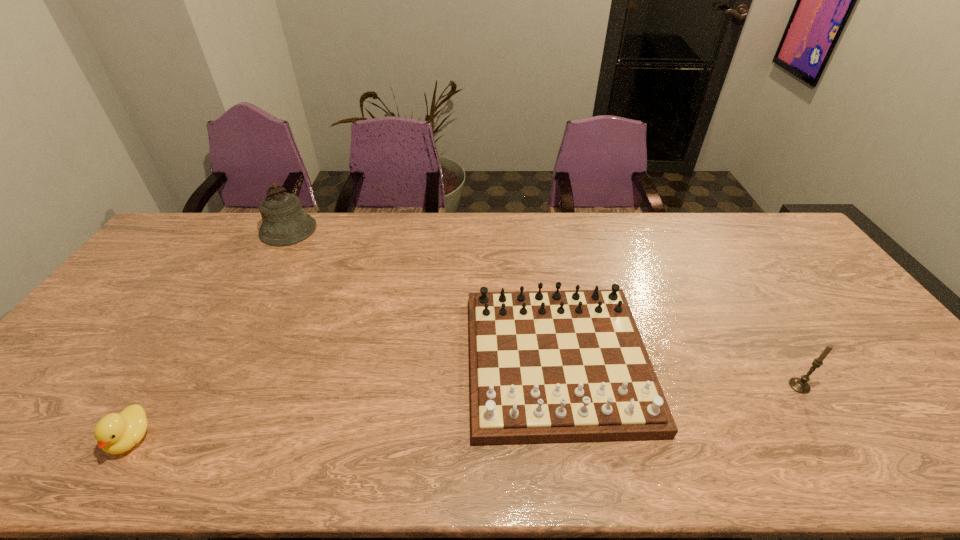
Locate an element on the screen. This screenshot has width=960, height=540. chessboard present at the near edge is located at coordinates (557, 366).

Find the location of `duckling located at the near edge`. duckling located at the near edge is located at coordinates (115, 433).

This screenshot has height=540, width=960. Identify the location of vacant space at the far edge. [588, 222].

Where is `blank space at the near edge of the desktop`? The image size is (960, 540). blank space at the near edge of the desktop is located at coordinates (320, 450).

Identify the location of blank space at the left edge of the desktop. The width and height of the screenshot is (960, 540). (119, 316).

Identify the location of free space at the right edge of the desktop. The image size is (960, 540). (784, 259).

Where is `free point between the duckling and the third object from left to right`? free point between the duckling and the third object from left to right is located at coordinates (345, 400).

Find the location of a particular element. free point between the chessboard and the bell is located at coordinates (422, 295).

Locate an element on the screen. The image size is (960, 540). free space between the third object from left to right and the duckling is located at coordinates (345, 400).

Image resolution: width=960 pixels, height=540 pixels. What are the coordinates of `vacant area that lies between the candle and the duckling` in the screenshot? It's located at (466, 412).